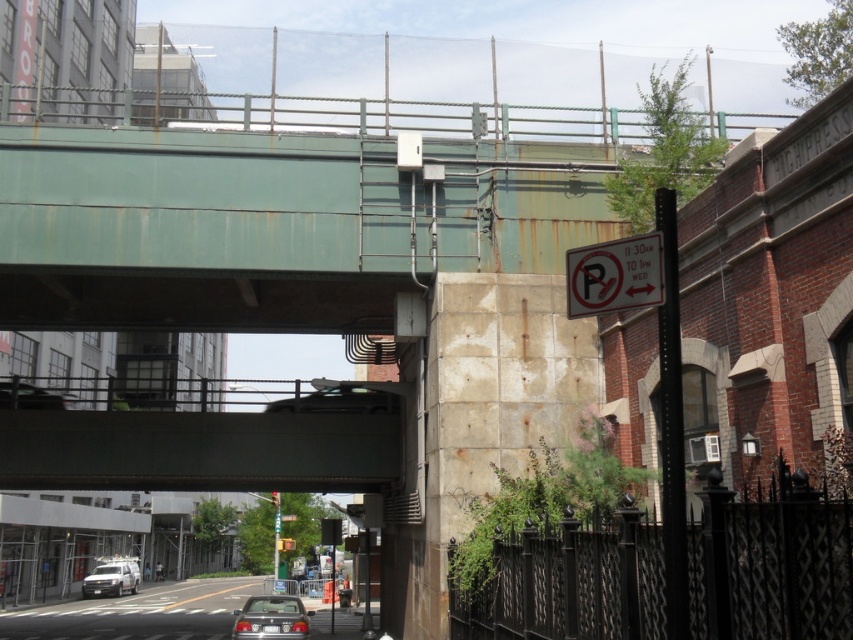
You are a pedestrian standing on the sidewalk next to the dark gray concrete bridge at center and the matte silver sedan at lower center. Which object is closer to your right side?

The matte silver sedan at lower center is closer to your right side because the dark gray concrete bridge at center is to its left.

You are a pedestrian standing at the corner of the street. You see the dark gray concrete bridge at center and the matte silver sedan at lower center. Which object is closer to you?

The dark gray concrete bridge at center is closer to you because the matte silver sedan at lower center is behind it.

You are a city planner reviewing the urban layout. Given the coordinates provided in the scene description, where is the dark gray concrete bridge at center positioned relative to the red brick building with arched windows?

The dark gray concrete bridge at center is positioned at coordinates point (206, 448), which places it near the red brick building with arched windows on the right side of the image.